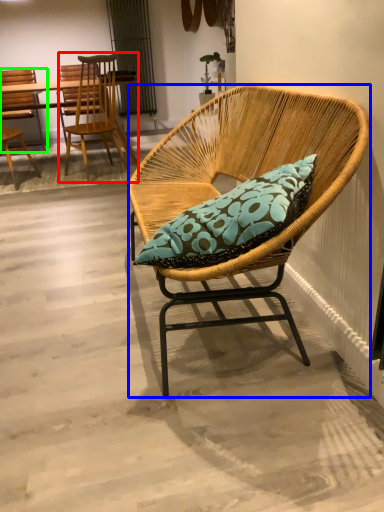
Question: Estimate the real-world distances between objects in this image. Which object is farther from chair (highlighted by a red box), chair (highlighted by a blue box) or chair (highlighted by a green box)?

Choices:
 (A) chair
 (B) chair

Answer: (A)